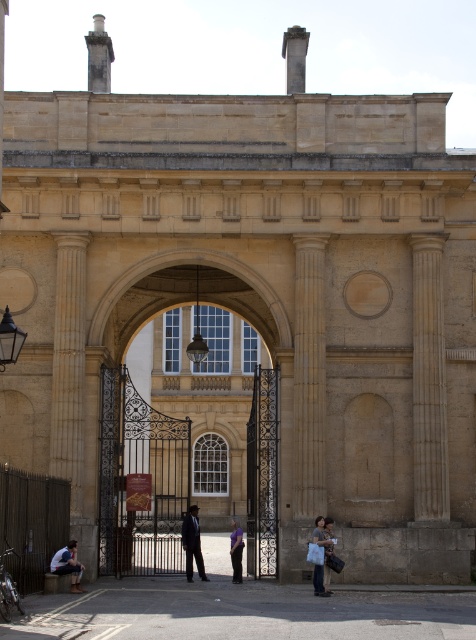
Between point (253, 490) and point (324, 566), which one is positioned in front?

Positioned in front is point (324, 566).

Does dark brown wrought iron gate at center have a lesser height compared to light brown leather jacket at lower right?

No.

You are a GUI agent. You are given a task and a screenshot of the screen. Output one action in this format:
    pyautogui.click(x=<x>, y=<y>)
    Task: Click on the dark brown wrought iron gate at center
    The image size is (476, 640).
    Given the screenshot: What is the action you would take?
    click(263, 474)

The width and height of the screenshot is (476, 640). I want to click on dark brown wrought iron gate at center, so click(x=263, y=474).

Based on the photo, does dark brown wrought iron gate at center appear over dark blue jeans at center?

Yes, dark brown wrought iron gate at center is above dark blue jeans at center.

Is dark brown wrought iron gate at center behind dark blue jeans at center?

No, it is in front of dark blue jeans at center.

You are a GUI agent. You are given a task and a screenshot of the screen. Output one action in this format:
    pyautogui.click(x=<x>, y=<y>)
    Task: Click on the dark brown wrought iron gate at center
    The width and height of the screenshot is (476, 640).
    Given the screenshot: What is the action you would take?
    pyautogui.click(x=263, y=474)

How much distance is there between light blue denim jacket at lower left and light brown leather jacket at lower right?

light blue denim jacket at lower left is 12.77 meters from light brown leather jacket at lower right.

Is light blue denim jacket at lower left below light brown leather jacket at lower right?

Correct, light blue denim jacket at lower left is located below light brown leather jacket at lower right.

The width and height of the screenshot is (476, 640). What are the coordinates of `light blue denim jacket at lower left` in the screenshot? It's located at (68, 564).